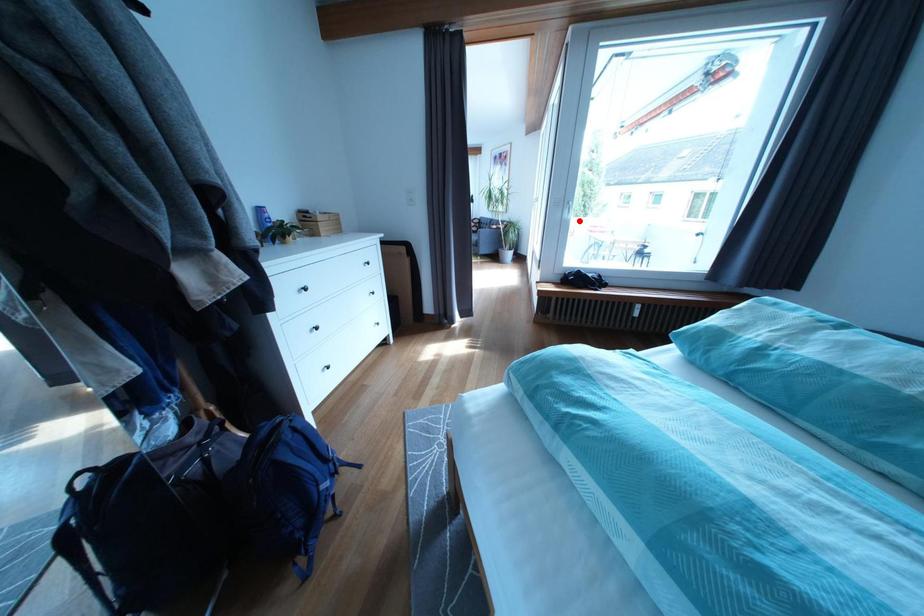
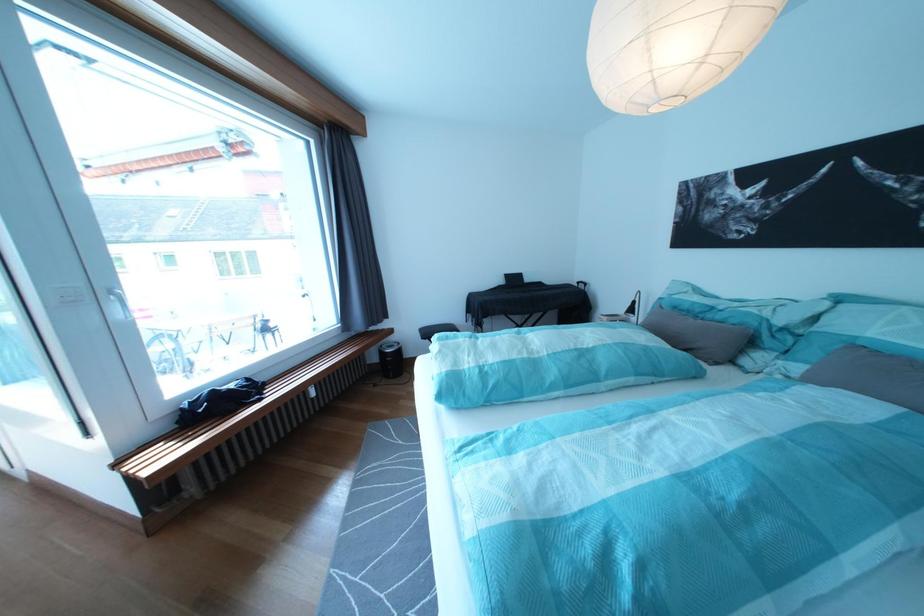
Question: I am providing you with two images of the same scene from different viewpoints. Given a red point in image1, look at the same physical point in image2. Is it:

Choices:
 (A) Closer to the viewpoint
 (B) Farther from the viewpoint

Answer: (B)